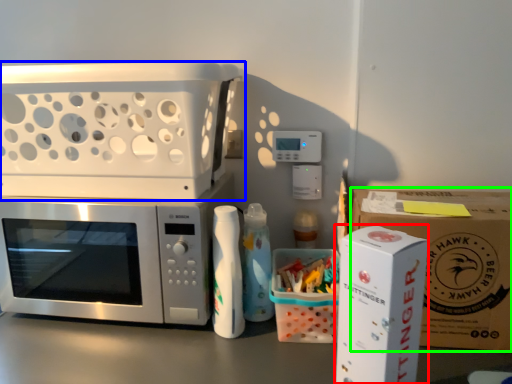
Question: Considering the real-world distances, which object is farthest from appliance (highlighted by a red box)? appliance (highlighted by a blue box) or cardboard box (highlighted by a green box)?

Choices:
 (A) appliance
 (B) cardboard box

Answer: (A)